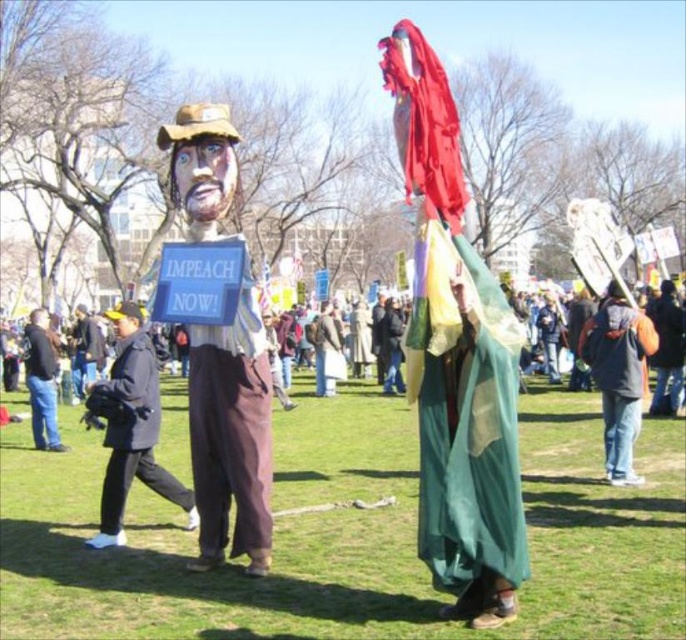
You are a photographer trying to capture both the matte cardboard figure at center and the jeans at left in a single frame. Based on their positions, which object should you focus on first to ensure both are in the shot?

The matte cardboard figure at center is positioned on the right side of jeans at left. To capture both in a single frame, focus on the jeans at left first as it is closer to the left edge, ensuring the matte cardboard figure at center remains within the right side of the frame.